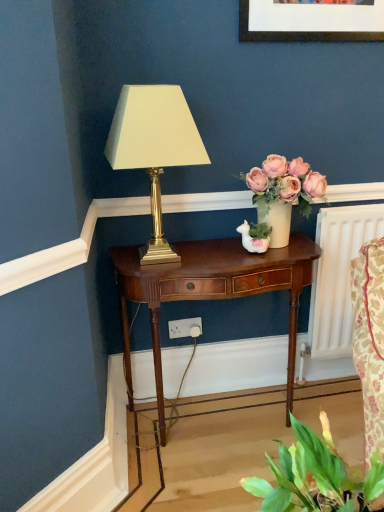
The width and height of the screenshot is (384, 512). Identify the location of vacant space underneath mahogany wood nightstand at center (from a real-world perspective). (216, 418).